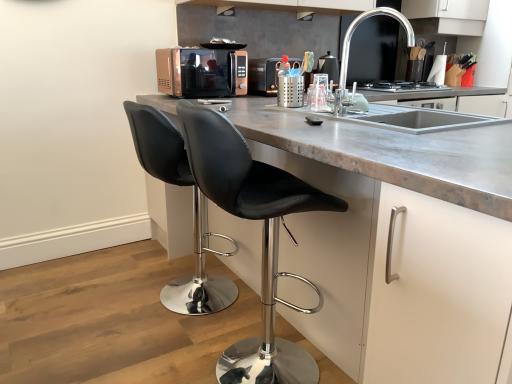
Identify the location of free space that is in between black leather stool at lower left, the second chair viewed from the front, and black leather stool at center, which ranks as the 2th chair in back-to-front order. (212, 326).